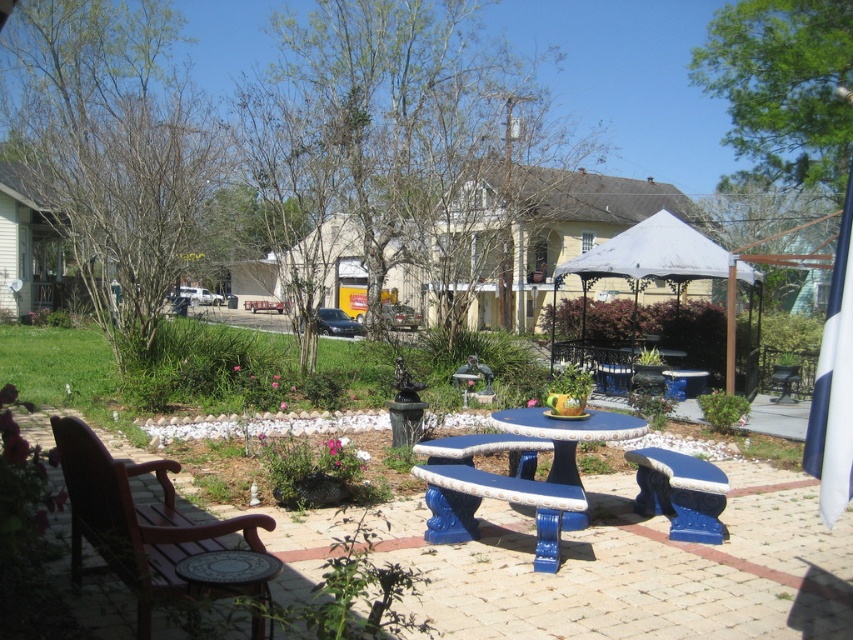
You are planning to host a small gathering and need to know if the white fabric gazebo at center can accommodate the blue painted wood bench at center. Based on their sizes, can the bench fit inside the gazebo?

The white fabric gazebo at center is wider than the blue painted wood bench at center, so the bench can fit inside the gazebo.

Based on the scene description, where is the white fabric gazebo at center located in terms of coordinates?

The white fabric gazebo at center is located at coordinates point (659, 259).

You are planning to place a small potted plant between the blue ceramic bench at center and the blue glossy table at center. Based on their positions, which object should the plant be closer to?

The plant should be closer to the blue glossy table at center because the blue ceramic bench at center is positioned to the right of the table.